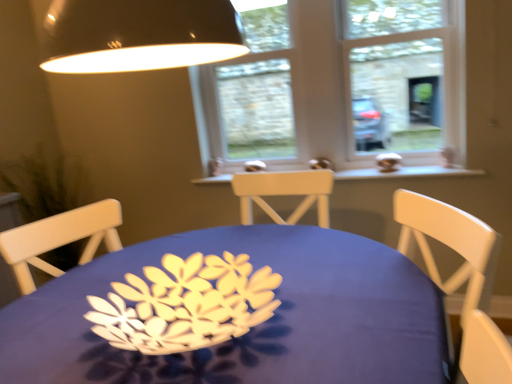
Question: From their relative heights in the image, would you say green matte plant at left is taller or shorter than white wood window sill at center?

Choices:
 (A) tall
 (B) short

Answer: (A)

Question: Is green matte plant at left to the left or to the right of white wood window sill at center in the image?

Choices:
 (A) right
 (B) left

Answer: (B)

Question: Considering the real-world distances, which object is farthest from the green matte plant at left?

Choices:
 (A) blue fabric table at center
 (B) white wood window sill at center
 (C) clear glass window at center
 (D) white plastic window frame at upper right

Answer: (D)

Question: Which object is positioned farthest from the blue fabric table at center?

Choices:
 (A) white plastic window frame at upper right
 (B) white wood window sill at center
 (C) clear glass window at center
 (D) green matte plant at left

Answer: (D)